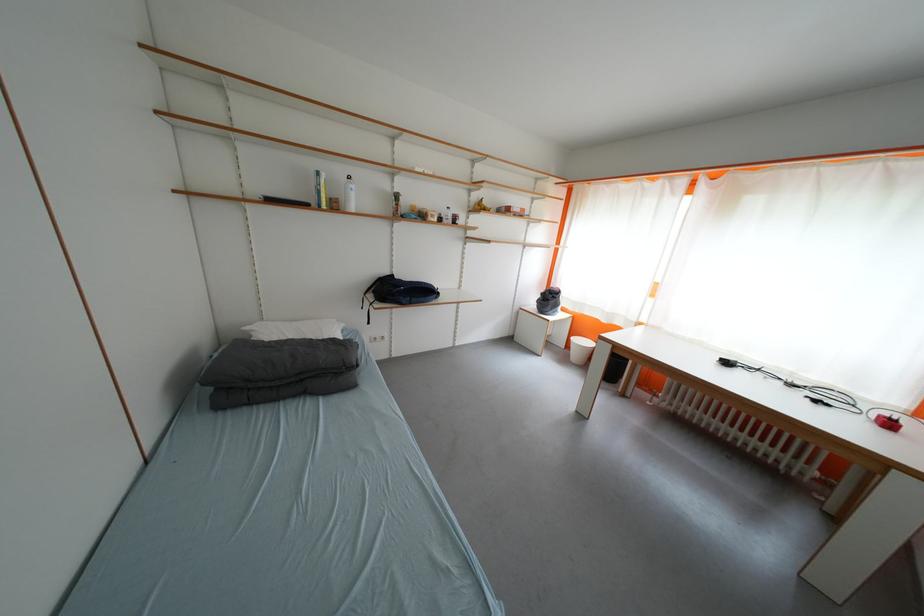
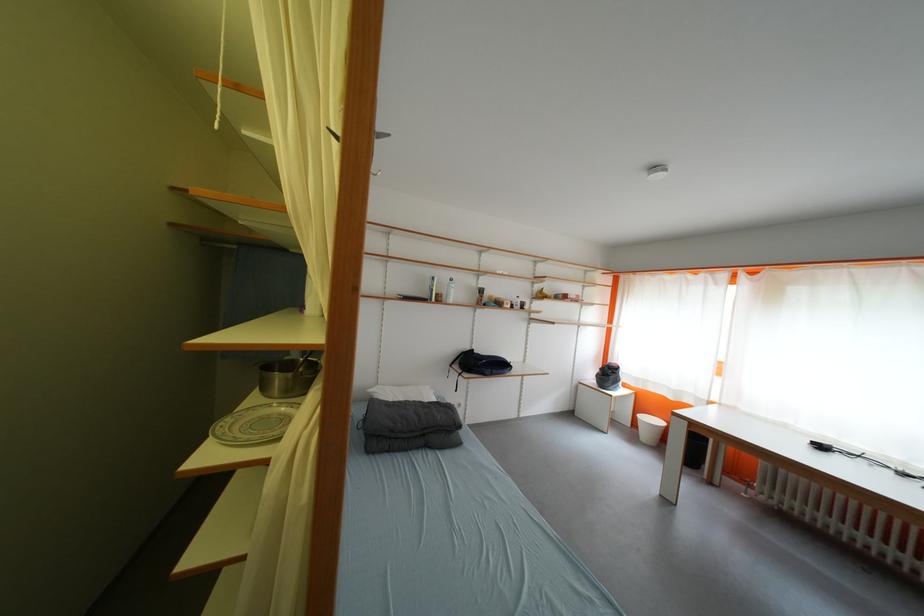
The point at [344,209] is marked in the first image. Where is the corresponding point in the second image?

(447, 302)